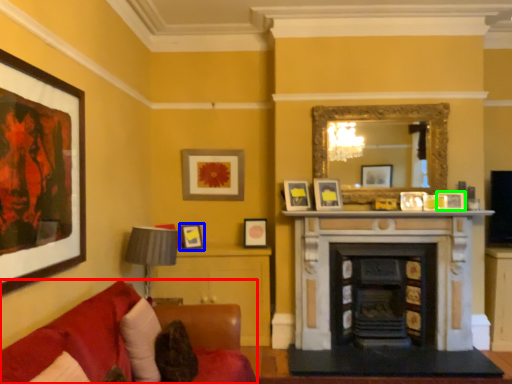
Question: Which is nearer to the studio couch (highlighted by a red box)? picture frame (highlighted by a blue box) or picture frame (highlighted by a green box).

Choices:
 (A) picture frame
 (B) picture frame

Answer: (A)